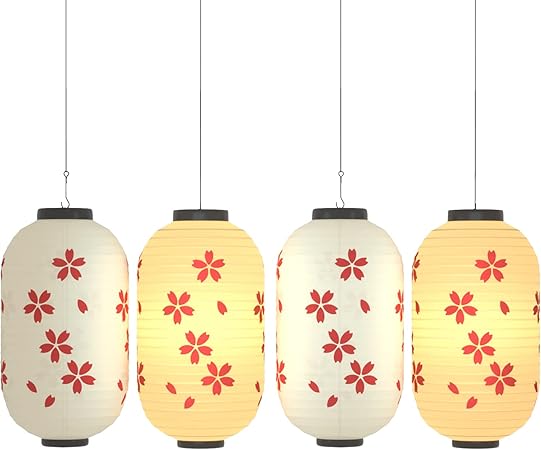
You are a GUI agent. You are given a task and a screenshot of the screen. Output one action in this format:
    pyautogui.click(x=<x>, y=<y>)
    Task: Click on the hook
    This screenshot has width=541, height=450.
    Given the screenshot: What is the action you would take?
    pyautogui.click(x=67, y=189), pyautogui.click(x=342, y=201)